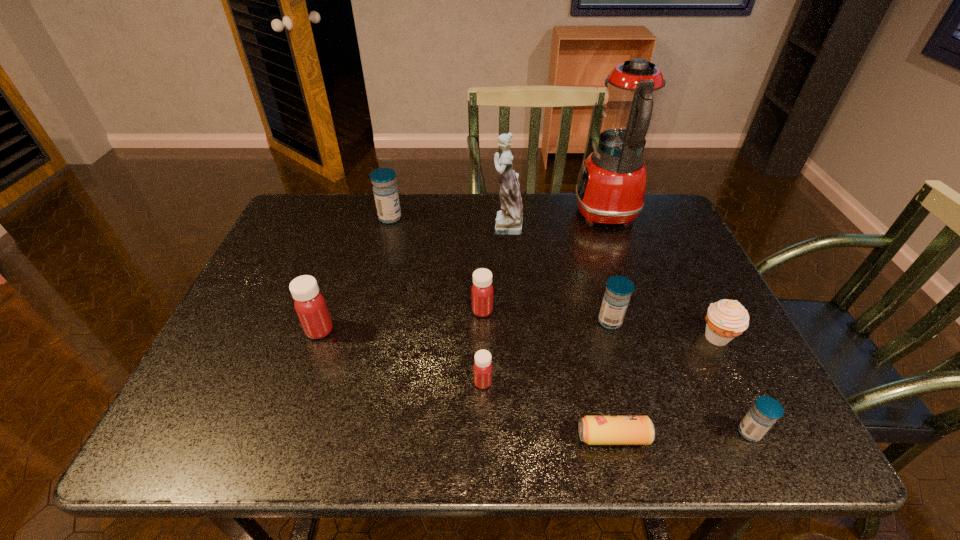
The image size is (960, 540). Identify the location of the fifth farthest medicine. (482, 369).

At what (x,y) coordinates should I click in order to perform the action: click on the smallest red medicine. Please return your answer as a coordinate pair (x, y). Looking at the image, I should click on (482, 369).

This screenshot has width=960, height=540. What are the coordinates of `the rightmost medicine` in the screenshot? It's located at (766, 410).

This screenshot has width=960, height=540. What are the coordinates of `the smallest blue medicine` in the screenshot? It's located at (766, 410).

This screenshot has width=960, height=540. Identify the location of the shortest object. (593, 430).

Identify the location of free space located on the controls of the food processor. Image resolution: width=960 pixels, height=540 pixels. (483, 215).

Where is `free spot located on the controls of the food processor`? free spot located on the controls of the food processor is located at coordinates coord(477,215).

The image size is (960, 540). I want to click on free location located 0.280m on the controls of the food processor, so [483, 215].

Where is `vacant space located 0.280m on the front-facing side of the figurine`? This screenshot has height=540, width=960. vacant space located 0.280m on the front-facing side of the figurine is located at coordinates (391, 225).

This screenshot has height=540, width=960. In order to click on free location located 0.260m on the front-facing side of the figurine in this screenshot , I will do `click(397, 225)`.